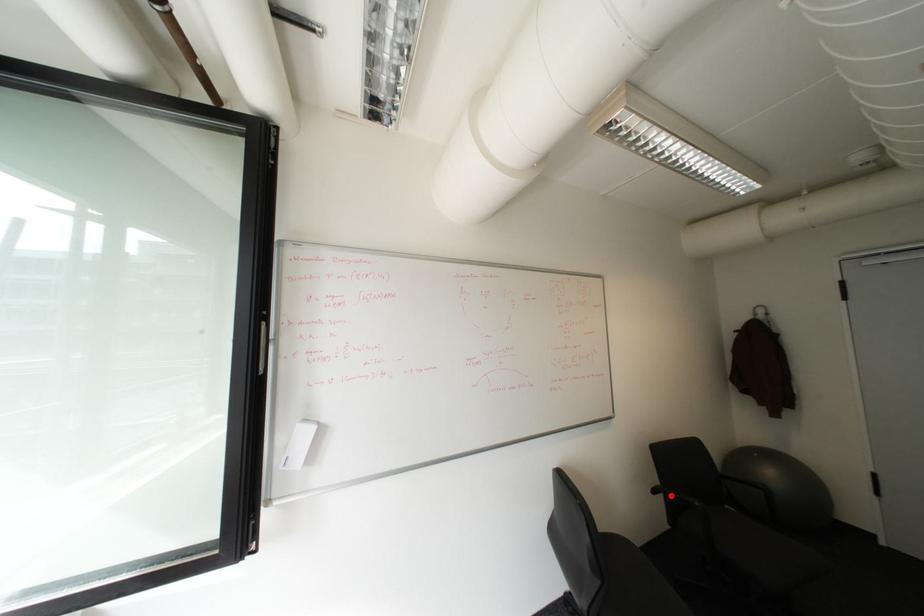
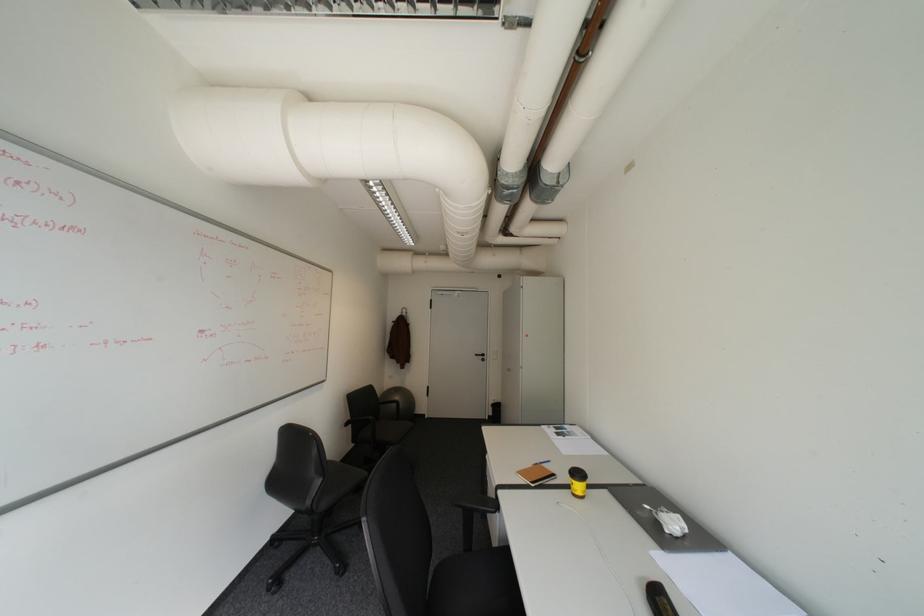
Find the pixel in the second image that matches the highlighted location in the first image.

(359, 426)